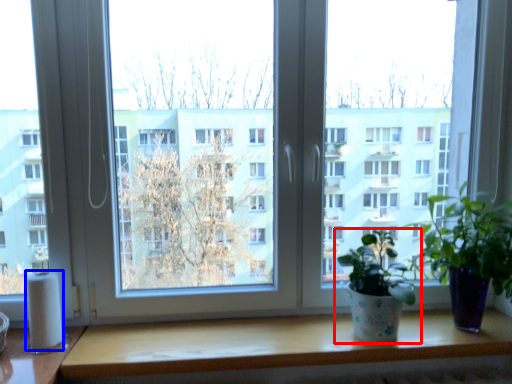
Question: Which of the following is the farthest to the observer, houseplant (highlighted by a red box) or toilet paper (highlighted by a blue box)?

Choices:
 (A) houseplant
 (B) toilet paper

Answer: (B)